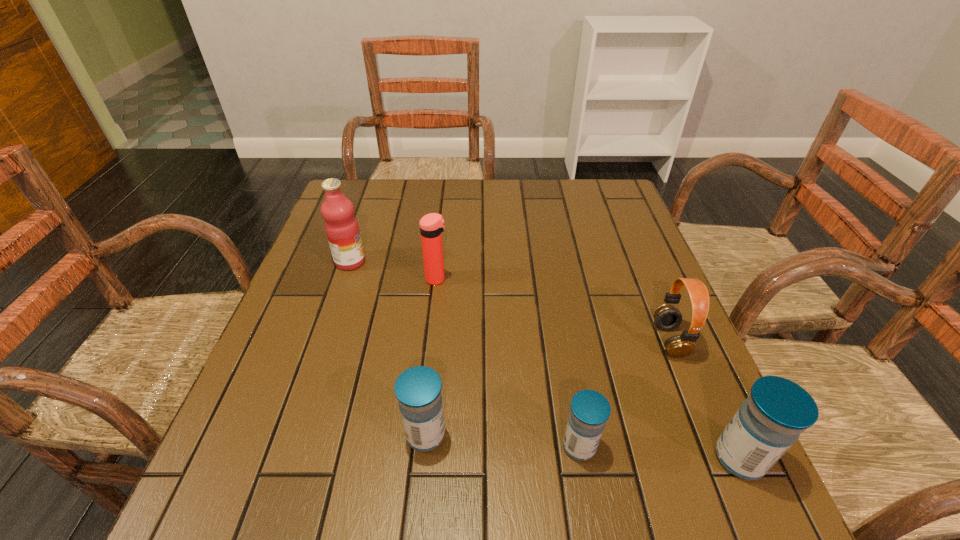
Where is `the leftmost medicine`? Image resolution: width=960 pixels, height=540 pixels. the leftmost medicine is located at coordinates (418, 389).

Find the location of a particular element. The width and height of the screenshot is (960, 540). the shortest object is located at coordinates tap(590, 410).

At what (x,y) coordinates should I click in order to perform the action: click on the third object from right to left. Please return your answer as a coordinate pair (x, y). This screenshot has height=540, width=960. Looking at the image, I should click on (590, 410).

Find the location of a particular element. The image size is (960, 540). the rightmost medicine is located at coordinates (777, 410).

At what (x,y) coordinates should I click in order to perform the action: click on the fourth nearest object. Please return your answer as a coordinate pair (x, y). This screenshot has width=960, height=540. Looking at the image, I should click on (667, 317).

Locate an element on the screen. Image resolution: width=960 pixels, height=540 pixels. the fifth nearest object is located at coordinates (431, 225).

Identify the location of the farthest object. (341, 226).

Where is `the tallest object`? This screenshot has height=540, width=960. the tallest object is located at coordinates (341, 226).

Where is `vacant region located on the right of the leftmost medicine`? The image size is (960, 540). vacant region located on the right of the leftmost medicine is located at coordinates (655, 435).

Find the location of a particular element. The image size is (960, 540). vacant space located on the back of the shortest object is located at coordinates (551, 282).